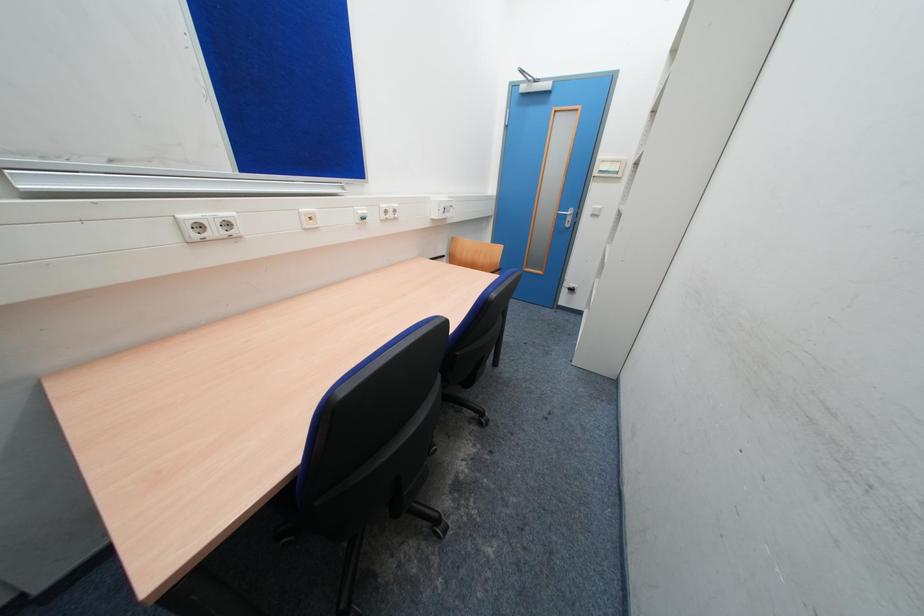
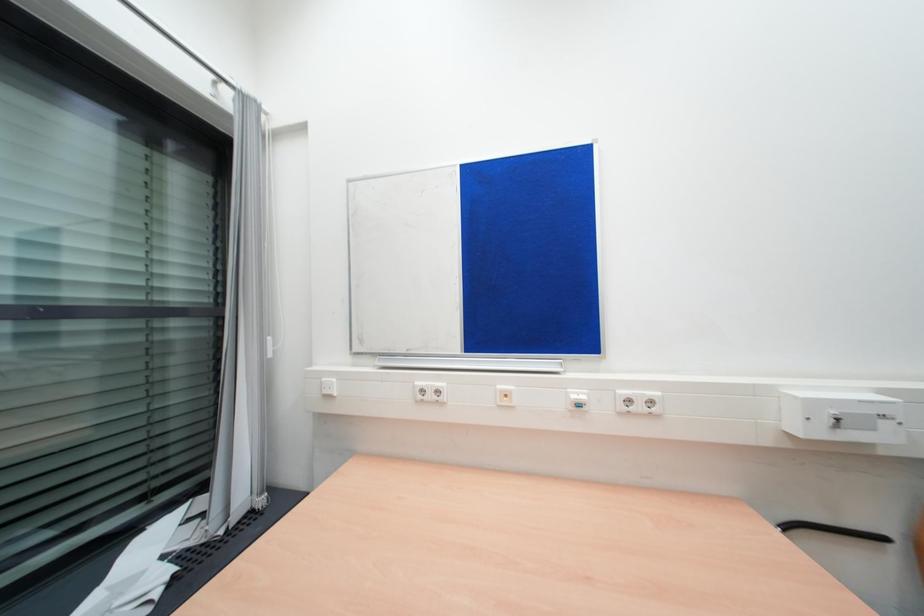
Question: How did the camera likely rotate?

Choices:
 (A) Left
 (B) Right
 (C) Up
 (D) Down

Answer: (A)